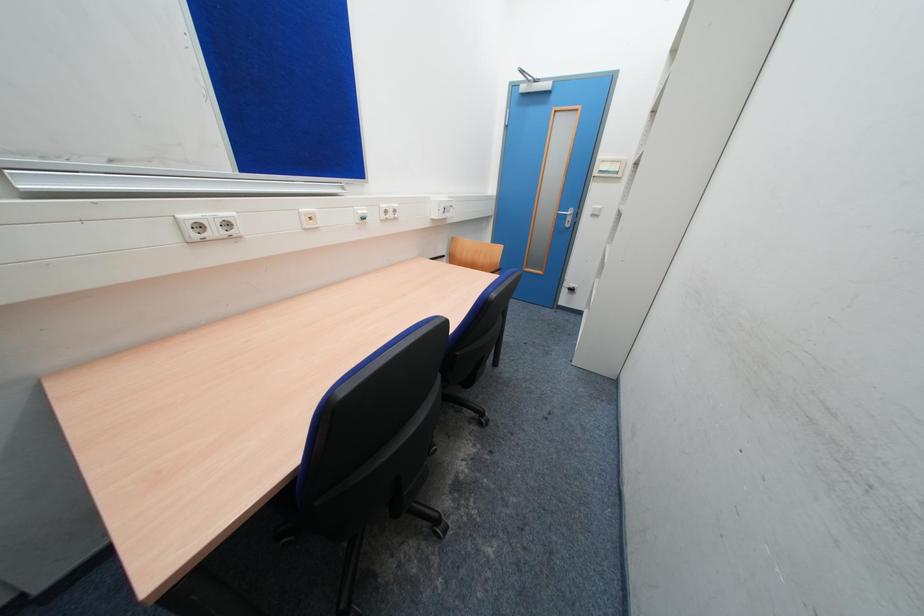
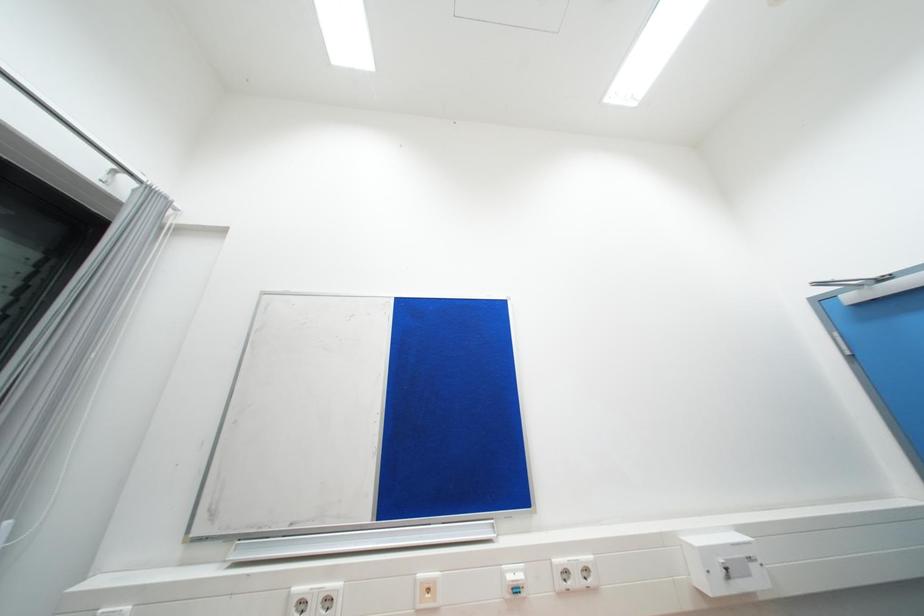
The images are taken continuously from a first-person perspective. In which direction is your viewpoint rotating?

The camera rotated toward left-up.